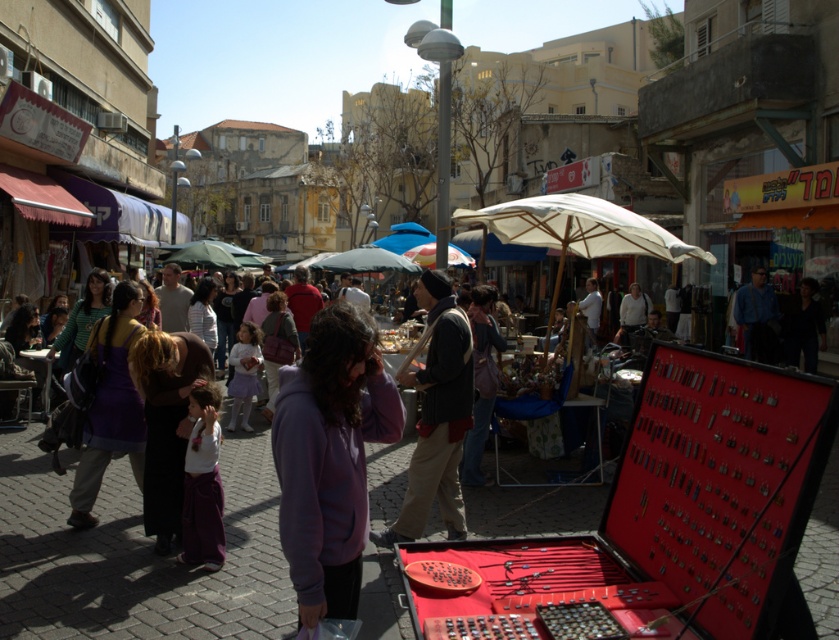
Does purple fleece jacket at center have a greater width compared to white fabric umbrella at center?

Incorrect, purple fleece jacket at center's width does not surpass white fabric umbrella at center's.

Describe the element at coordinates (331, 458) in the screenshot. The image size is (839, 640). I see `purple fleece jacket at center` at that location.

Is point (340, 461) positioned behind point (641, 248)?

That is False.

At what (x,y) coordinates should I click in order to perform the action: click on purple fleece jacket at center. Please return your answer as a coordinate pair (x, y). The image size is (839, 640). Looking at the image, I should click on (331, 458).

Can you confirm if purple fleece jacket at center is smaller than knitted wool scarf at center?

Yes.

Does point (392, 397) lie in front of point (421, 467)?

Yes, it is.

The image size is (839, 640). I want to click on purple fleece jacket at center, so click(x=331, y=458).

Does knitted wool scarf at center appear under white fabric umbrella at center?

Yes, knitted wool scarf at center is below white fabric umbrella at center.

Consider the image. Which is below, knitted wool scarf at center or white fabric umbrella at center?

knitted wool scarf at center is below.

Locate an element on the screen. Image resolution: width=839 pixels, height=640 pixels. knitted wool scarf at center is located at coordinates (436, 417).